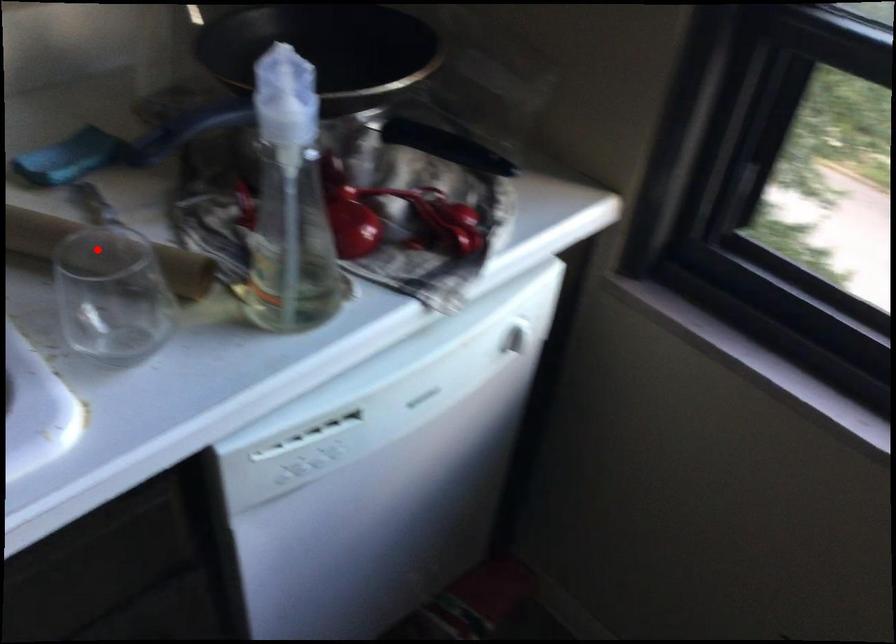
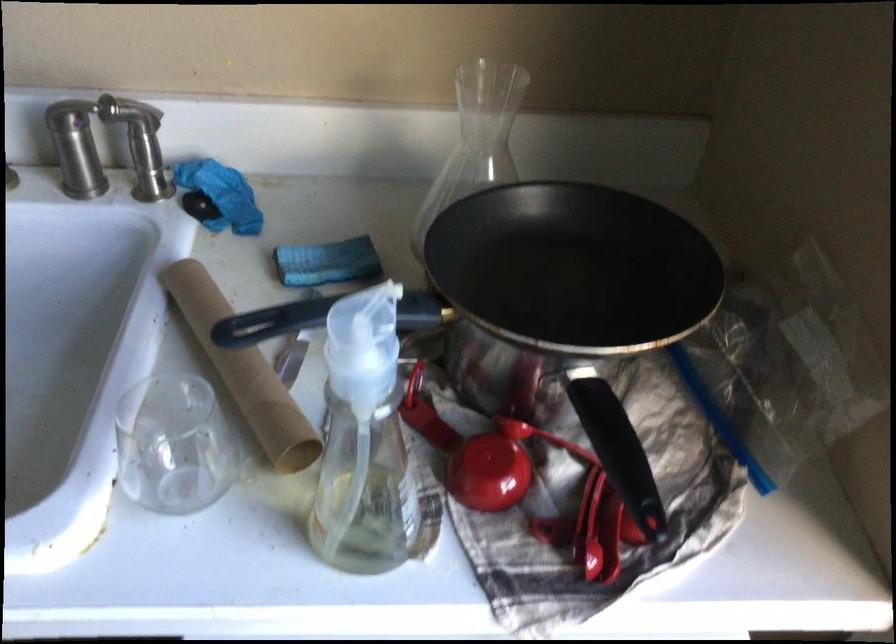
In the second image, find the point that corresponds to the highlighted location in the first image.

(243, 371)